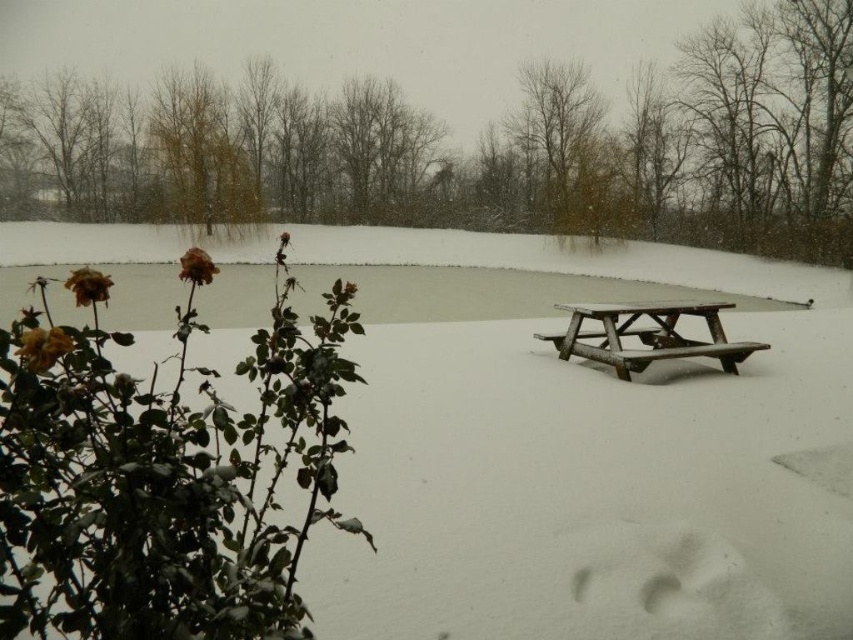
You are planning to build a snowman using the white matte snow at center. The bare branches at upper center are 16.93 meters away. Is the snow close enough to the branches to use them as a backdrop for your snowman?

The distance between the white matte snow at center and the bare branches at upper center is 16.93 meters. Since this distance is relatively large, the branches may not serve as an ideal close backdrop for the snowman. However, they could still be visible in the background depending on the viewing angle and perspective.

In the scene shown: You are an artist sketching the winter scene. You need to decide which object to draw first based on their size. Which one should you start with, the bare branches at upper center or the dried rose at left?

The dried rose at left has a greater width than the bare branches at upper center, so you should start with the dried rose at left since it is wider.

You are an artist trying to paint this winter scene. You want to ensure the proportions between the bare branches at upper center and the dried rose at left are accurate. Which object should you paint first to establish the scale?

You should paint the dried rose at left first because it is larger than the bare branches at upper center, so establishing its size will help you accurately scale the smaller branches afterward.